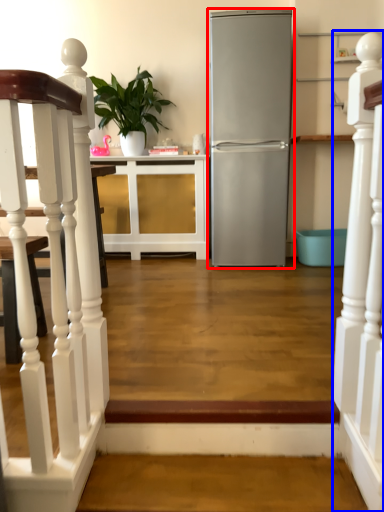
Question: Which point is further to the camera, refrigerator (highlighted by a red box) or rail (highlighted by a blue box)?

Choices:
 (A) refrigerator
 (B) rail

Answer: (A)